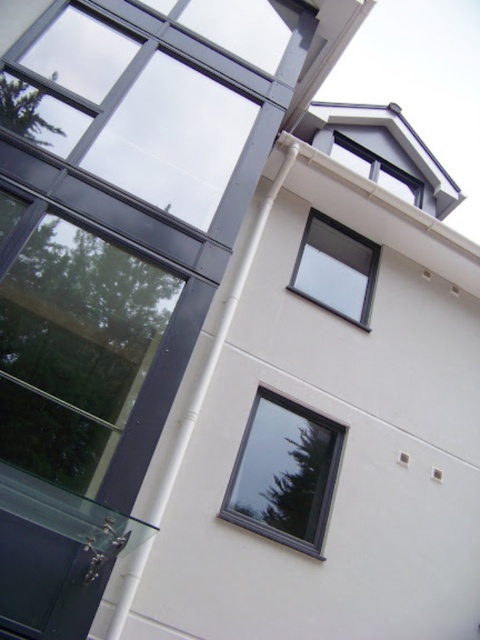
You are standing in front of the modern residential building and want to locate two specific points marked on the facade. The first point is at coordinate point (240, 497) and the second is at coordinate point (319, 268). Which of these two points is closer to you when viewed from your current position?

Point (240, 497) is in front of point (319, 268), so it is closer to you when viewed from your current position.

You are standing at the base of the modern architectural structure shown in the image. You need to reach the transparent glass window at upper center for maintenance. Given that the ladder you have can extend up to 15 feet, will it be sufficient to reach the window?

The transparent glass window at upper center is 18.60 feet away from the camera, which exceeds the ladder extension limit of 15 feet. Therefore, the ladder is not sufficient to reach the window.

You are standing in front of the modern residential building and notice two points marked on the facade. The first point is at coordinate point (275, 419) and the second is at point (352, 140). Which of these points is nearer to your current position?

Point (275, 419) is closer to the viewer than point (352, 140), so the first point is nearer to your current position.